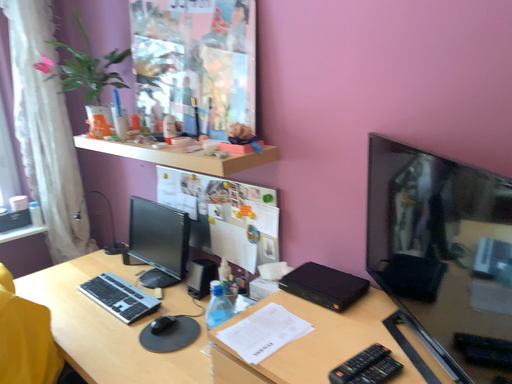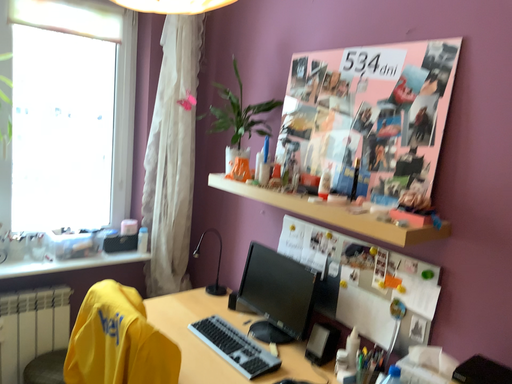
Question: Which way did the camera rotate in the video?

Choices:
 (A) rotated upward
 (B) rotated downward

Answer: (A)